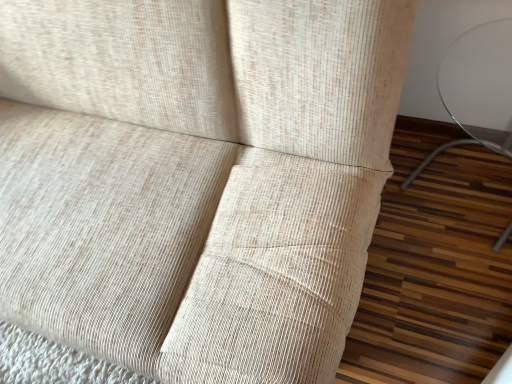
Measure the distance between point (501, 100) and camera.

Point (501, 100) and camera are 4.16 feet apart.

What are the coordinates of `transparent glass side table at right` in the screenshot? It's located at (478, 89).

The image size is (512, 384). What do you see at coordinates (478, 89) in the screenshot?
I see `transparent glass side table at right` at bounding box center [478, 89].

In order to click on transparent glass side table at right in this screenshot , I will do `click(478, 89)`.